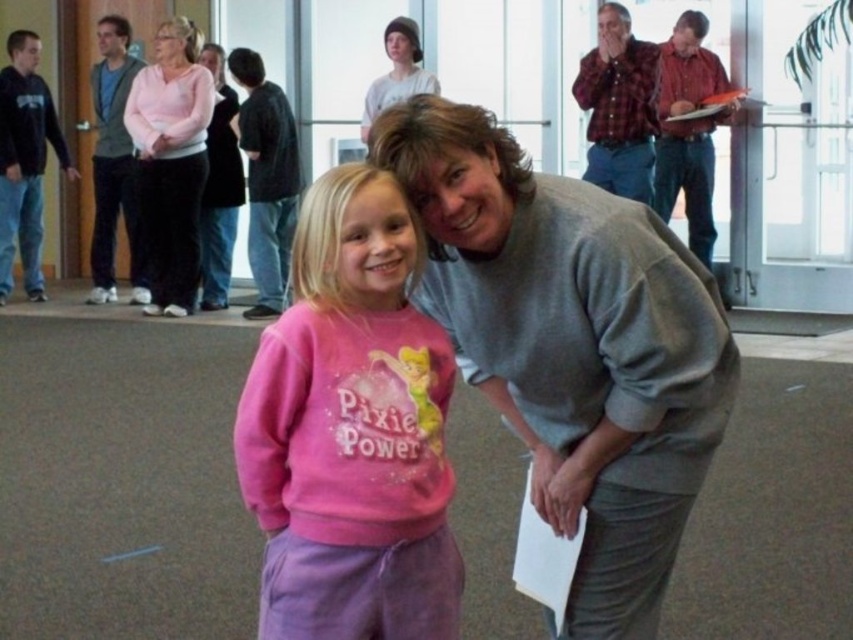
You are a fashion designer analyzing clothing items in an image. You see a dark blue hoodie at left and a gray sweater at upper center. Which clothing item is wider?

The dark blue hoodie at left is wider than the gray sweater at upper center.

You are taking a photo of two people at an event. The first person is at point (163, 209) and the second is at point (392, 36). Which person is closer to the camera?

The person at point (163, 209) is closer to the camera than the person at point (392, 36).